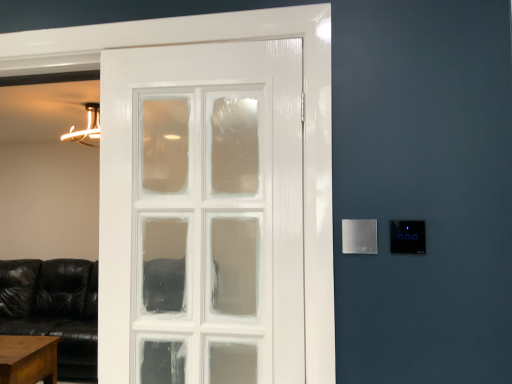
Question: Is brown wooden table at lower left taller or shorter than satin silver panel at right, which is the 1th light switch in right-to-left order?

Choices:
 (A) short
 (B) tall

Answer: (B)

Question: Is point (11, 336) positioned closer to the camera than point (423, 253)?

Choices:
 (A) farther
 (B) closer

Answer: (A)

Question: Which of these objects is positioned farthest from the brown wooden table at lower left?

Choices:
 (A) satin silver panel at right, which is the 1th light switch in right-to-left order
 (B) satin silver panel at right, marked as the 2th light switch in a right-to-left arrangement

Answer: (A)

Question: Which is nearer to the brown wooden table at lower left?

Choices:
 (A) satin silver panel at right, arranged as the 2th light switch when viewed from the left
 (B) satin silver panel at right, marked as the 2th light switch in a right-to-left arrangement

Answer: (B)